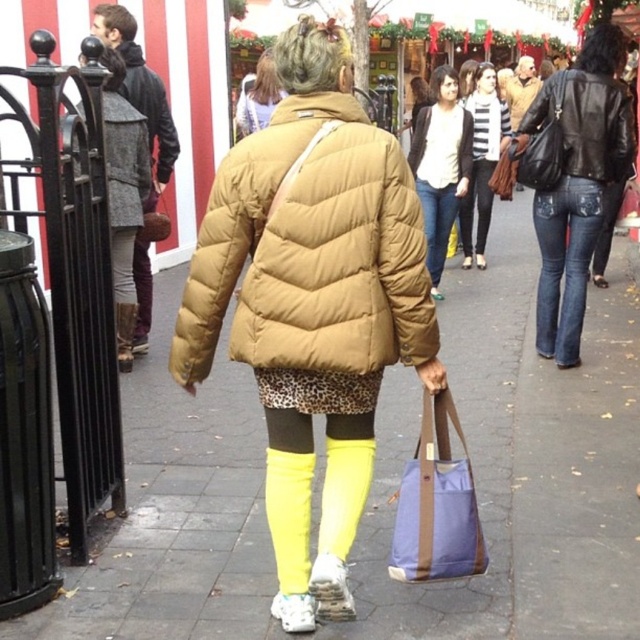
You are standing at the origin point of the image coordinate system. The image coordinate system has its origin at the bottom left corner. You want to locate the tan quilted jacket at center. What are its coordinates?

The coordinates of the tan quilted jacket at center are at point (310, 252).

You are a photographer trying to capture both the tan quilted jacket at center and the gray wool coat at left in a single frame. Based on their positions, which one is closer to the camera?

The tan quilted jacket at center is located below the gray wool coat at left, meaning it is closer to the camera.

You are a fashion designer observing the scene and want to create a new outfit. Which item, the tan quilted jacket at center or the jeans at right, should you prioritize in terms of height to ensure the outfit looks balanced?

The tan quilted jacket at center has a lesser height compared to the jeans at right. To balance the outfit, prioritize increasing the height of the tan quilted jacket at center or shorten the jeans at right.